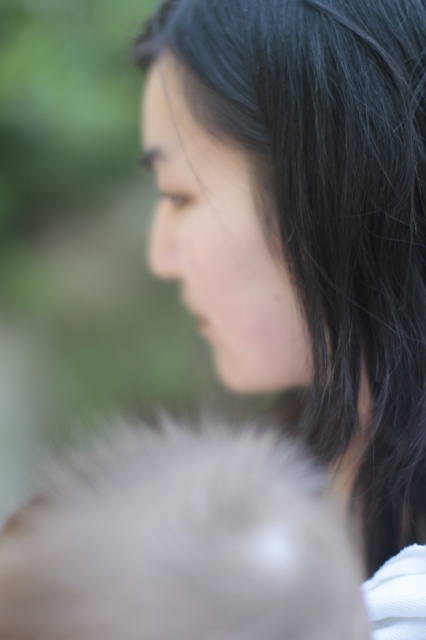
In the scene shown: Is black silky hair at center bigger than fuzzy white fur at lower left?

Correct, black silky hair at center is larger in size than fuzzy white fur at lower left.

Is black silky hair at center to the right of fuzzy white fur at lower left from the viewer's perspective?

Yes, black silky hair at center is to the right of fuzzy white fur at lower left.

Does point (351, 340) come in front of point (141, 548)?

No.

Where is `black silky hair at center`? Image resolution: width=426 pixels, height=640 pixels. black silky hair at center is located at coordinates (336, 205).